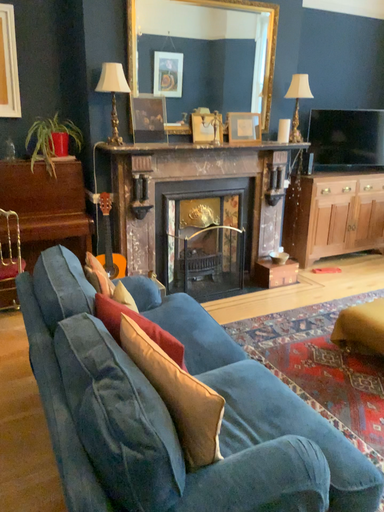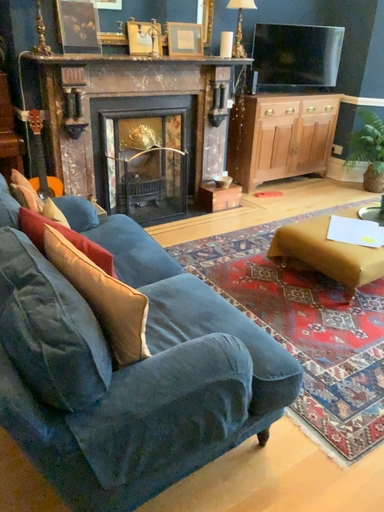
Question: How did the camera likely rotate when shooting the video?

Choices:
 (A) rotated right
 (B) rotated left

Answer: (A)